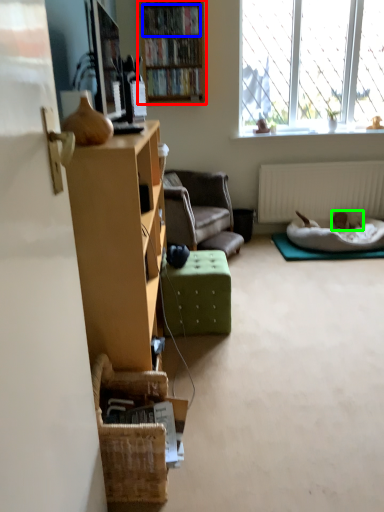
Question: Which is farther away from bookcase (highlighted by a red box)? book (highlighted by a blue box) or animal (highlighted by a green box)?

Choices:
 (A) book
 (B) animal

Answer: (B)